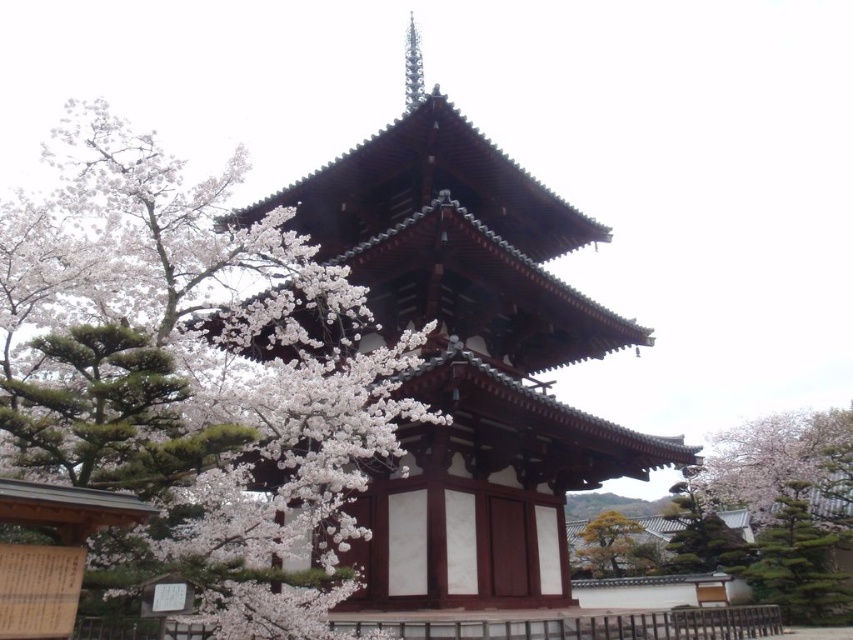
You are standing in front of the traditional Japanese pagoda and notice the white blossoms at center and the green textured pine tree at right. Which object is closer to you?

The white blossoms at center is closer to you because it is in front of the green textured pine tree at right.

You are standing in front of the traditional Japanese pagoda and notice a point marked at coordinates (799, 563). What object is located at that point?

The point at coordinates (799, 563) indicates a green textured pine tree at right.